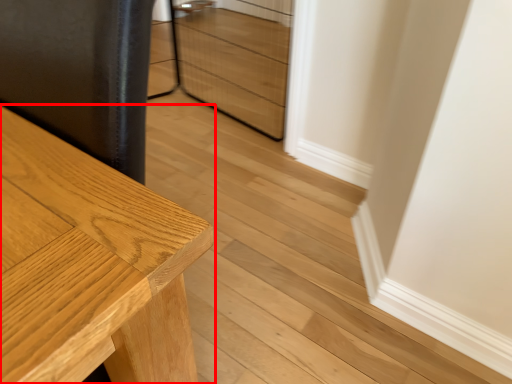
Question: Where is table (annotated by the red box) located in relation to drawer in the image?

Choices:
 (A) left
 (B) right

Answer: (A)